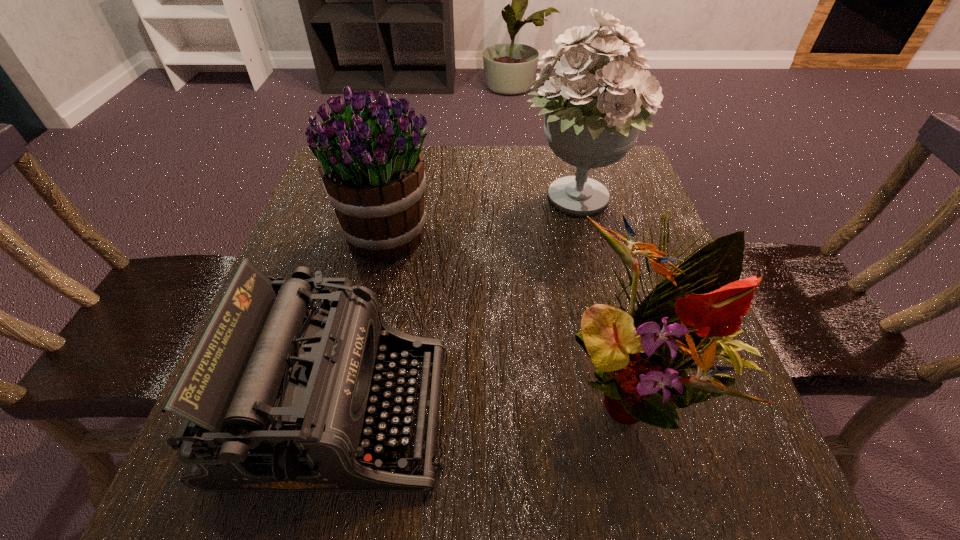
Where is `bouquet that stands as the second closest to the leftmost bouquet`? This screenshot has height=540, width=960. bouquet that stands as the second closest to the leftmost bouquet is located at coordinates (692, 314).

Choose which bouquet is the second nearest neighbor to the nearest bouquet. Please provide its 2D coordinates. Your answer should be formatted as a tuple, i.e. [(x, y)], where the tuple contains the x and y coordinates of a point satisfying the conditions above.

[(372, 168)]

Where is `vacant space that satisfies the following two spatial constraints: 1. on the front-facing side of the nearest bouquet; 2. on the keyboard of the shortest object`? Image resolution: width=960 pixels, height=540 pixels. vacant space that satisfies the following two spatial constraints: 1. on the front-facing side of the nearest bouquet; 2. on the keyboard of the shortest object is located at coordinates (638, 411).

This screenshot has width=960, height=540. I want to click on free location that satisfies the following two spatial constraints: 1. on the front-facing side of the nearest bouquet; 2. on the keyboard of the typewriter, so click(638, 411).

Locate an element on the screen. This screenshot has height=540, width=960. vacant area in the image that satisfies the following two spatial constraints: 1. on the front-facing side of the nearest bouquet; 2. on the keyboard of the typewriter is located at coordinates (638, 411).

Where is `vacant area that satisfies the following two spatial constraints: 1. on the front-facing side of the nearest bouquet; 2. on the keyboard of the typewriter`? vacant area that satisfies the following two spatial constraints: 1. on the front-facing side of the nearest bouquet; 2. on the keyboard of the typewriter is located at coordinates (638, 411).

Where is `blank space that satisfies the following two spatial constraints: 1. on the front-facing side of the nearest bouquet; 2. on the keyboard of the shortest object`? blank space that satisfies the following two spatial constraints: 1. on the front-facing side of the nearest bouquet; 2. on the keyboard of the shortest object is located at coordinates (638, 411).